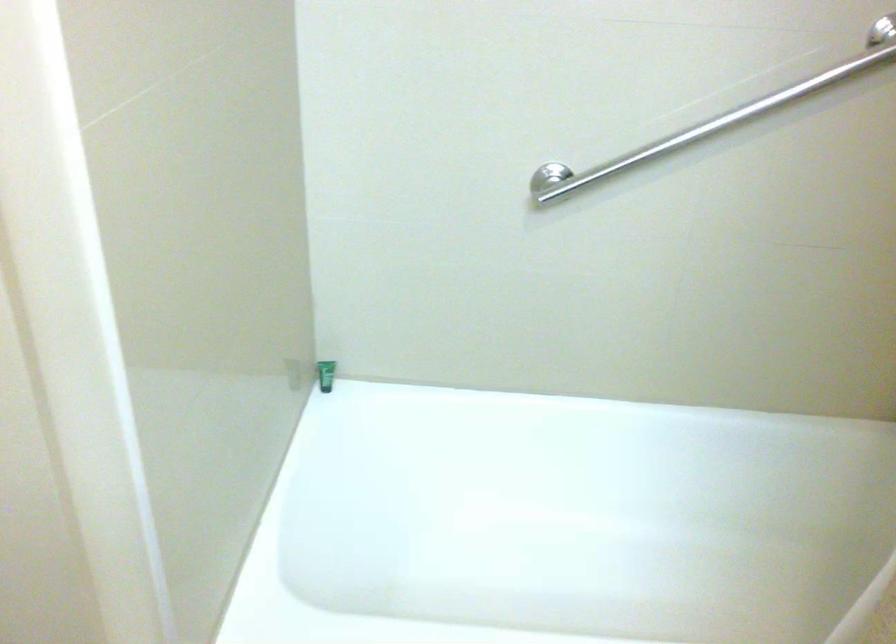
Question: The camera is either moving clockwise (left) or counter-clockwise (right) around the object. The first image is from the beginning of the video and the second image is from the end. Is the camera moving left or right when shooting the video?

Choices:
 (A) Left
 (B) Right

Answer: (A)